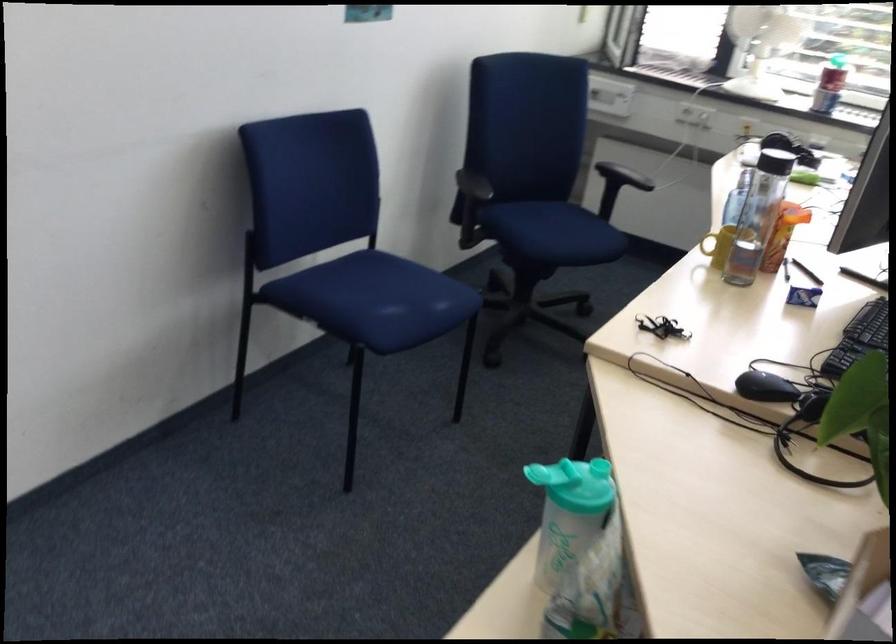
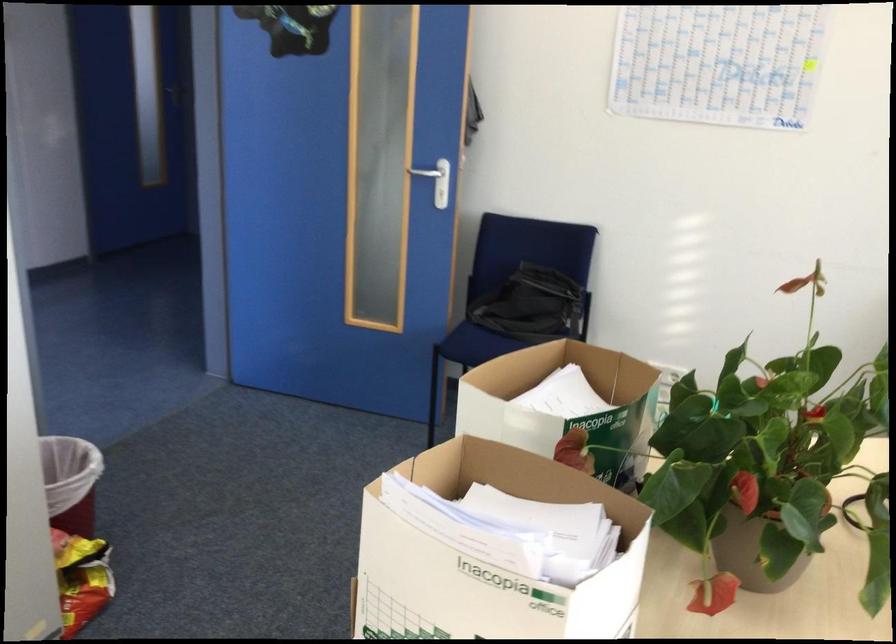
Question: I am providing you with two images of the same scene from different viewpoints. After the viewpoint changes to image2, which objects are now occluded?

Choices:
 (A) small brown notebook
 (B) white door handle
 (C) brown flower pot
 (D) clear water bottle

Answer: (D)